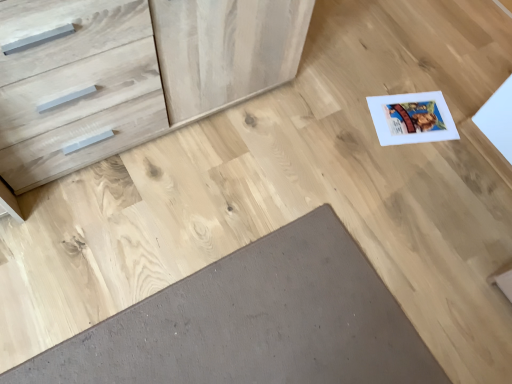
Find the location of a particular element. The height and width of the screenshot is (384, 512). vacant space behind brown matte doormat at lower center is located at coordinates (294, 169).